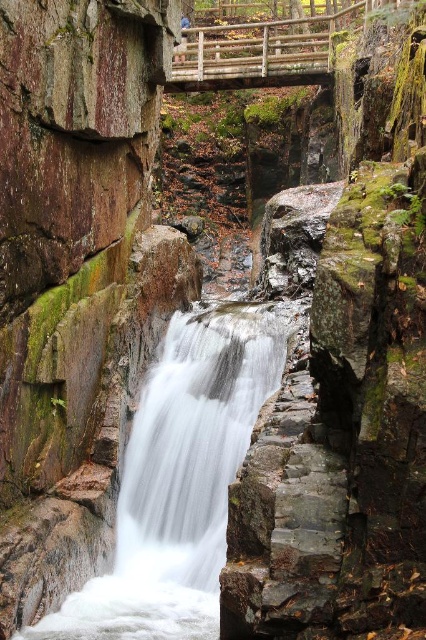
You are standing at the point marked as point (x=215, y=612) and want to cross the wooden bridge. The bridge is 30 meters long. Can you safely walk across it?

The distance between you and the viewer is 27.72 meters, but the bridge is 30 meters long. Since the bridge is longer than the distance between you and the viewer, you can safely walk across it.

You are planning to cross the wooden bridge at upper center to reach the other side of the gorge. However, you notice the white smooth water at center below the bridge. Considering their sizes, which one occupies more space in the image?

The wooden bridge at upper center occupies more space in the image than the white smooth water at center because the white smooth water at center is smaller than wooden bridge at upper center.

You are a hiker who wants to cross the wooden bridge at upper center to reach the other side. However, you notice the white smooth water at center below the bridge. Can you safely cross the bridge without getting wet?

The white smooth water at center and wooden bridge at upper center are 27.73 meters apart, so the distance between them is too large for the water to reach the bridge. Therefore, you can safely cross the wooden bridge at upper center without getting wet.